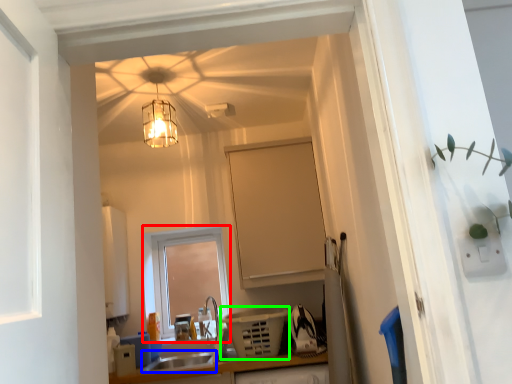
Question: Estimate the real-world distances between objects in this image. Which object is closer to window (highlighted by a red box), sink (highlighted by a blue box) or appliance (highlighted by a green box)?

Choices:
 (A) sink
 (B) appliance

Answer: (A)